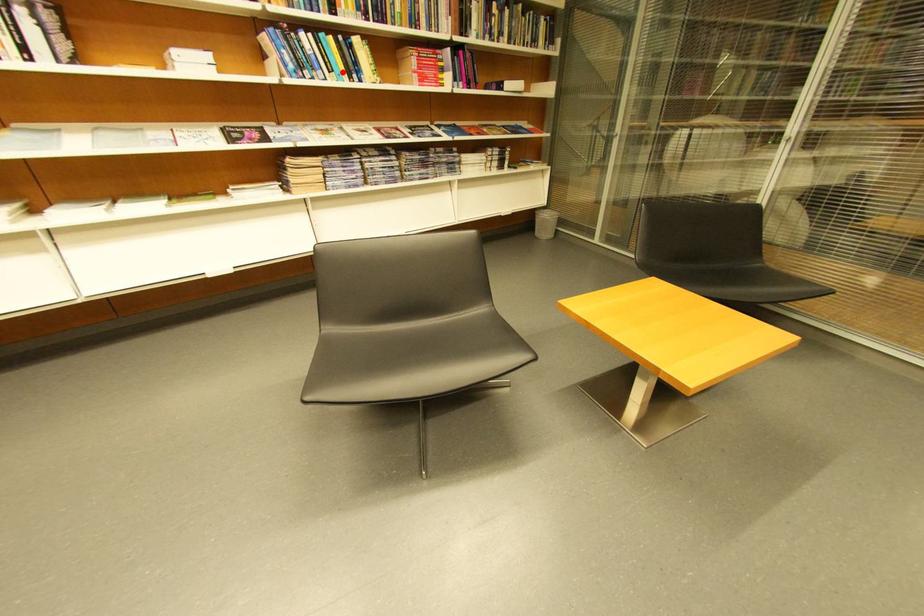
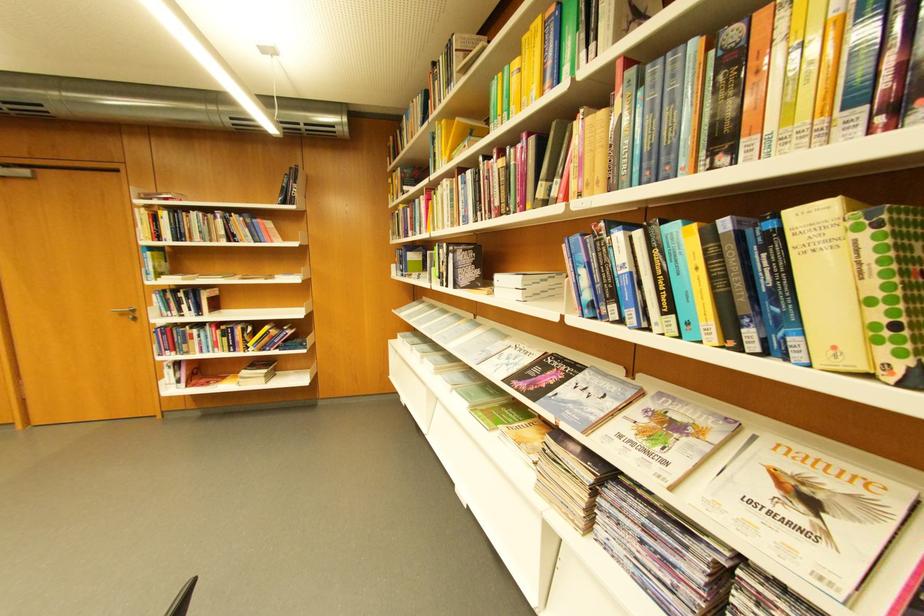
Locate, in the second image, the point that corresponds to the highlighted location in the first image.

(681, 310)